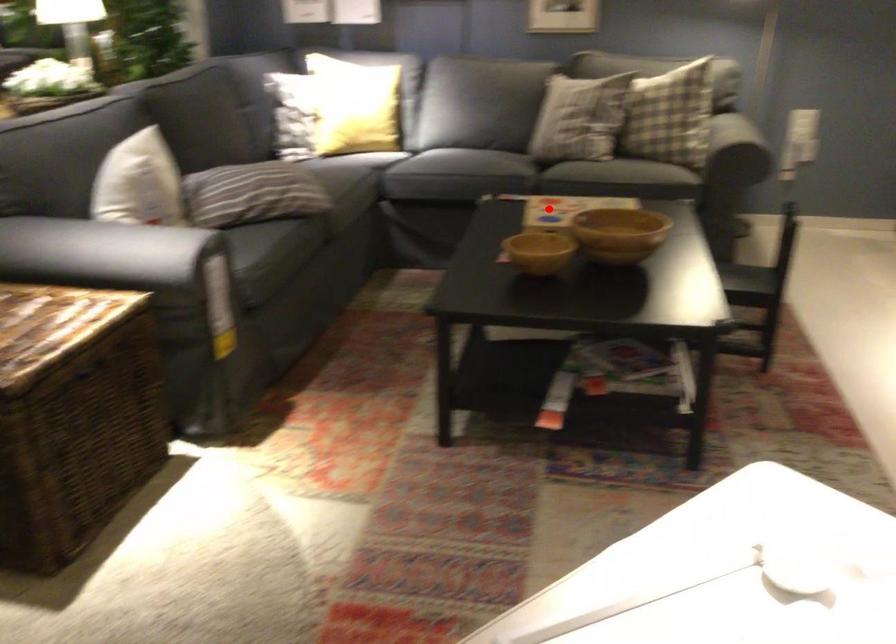
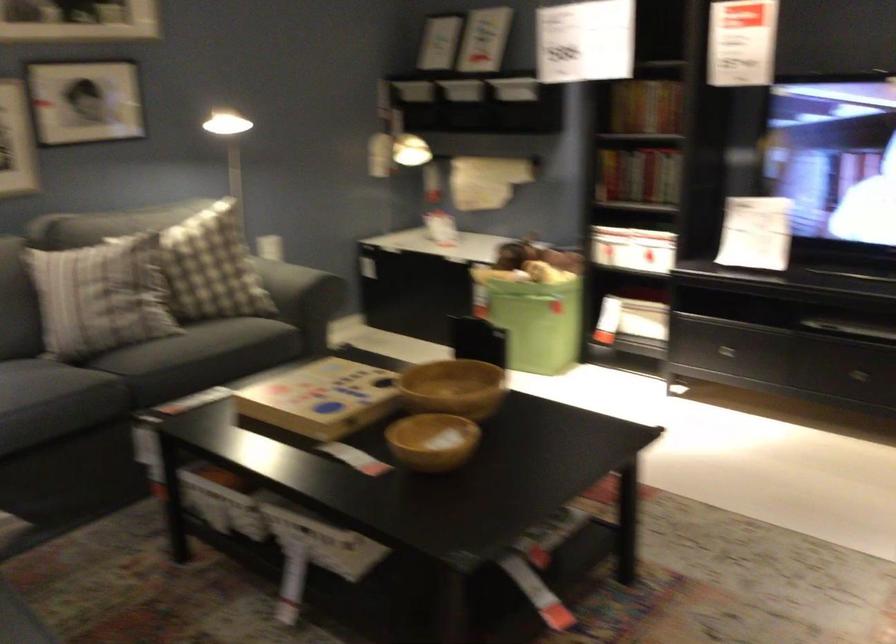
In the second image, find the point that corresponds to the highlighted location in the first image.

(320, 399)